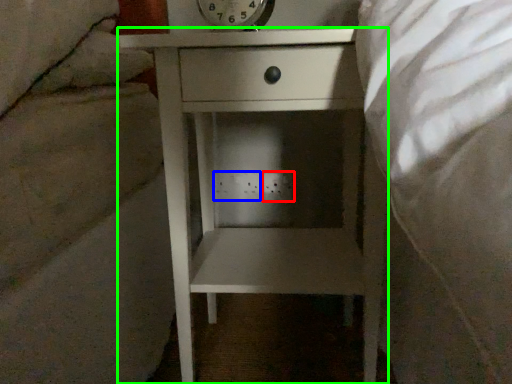
Question: Based on their relative distances, which object is nearer to electric outlet (highlighted by a red box)? Choose from electric outlet (highlighted by a blue box) and nightstand (highlighted by a green box).

Choices:
 (A) electric outlet
 (B) nightstand

Answer: (A)